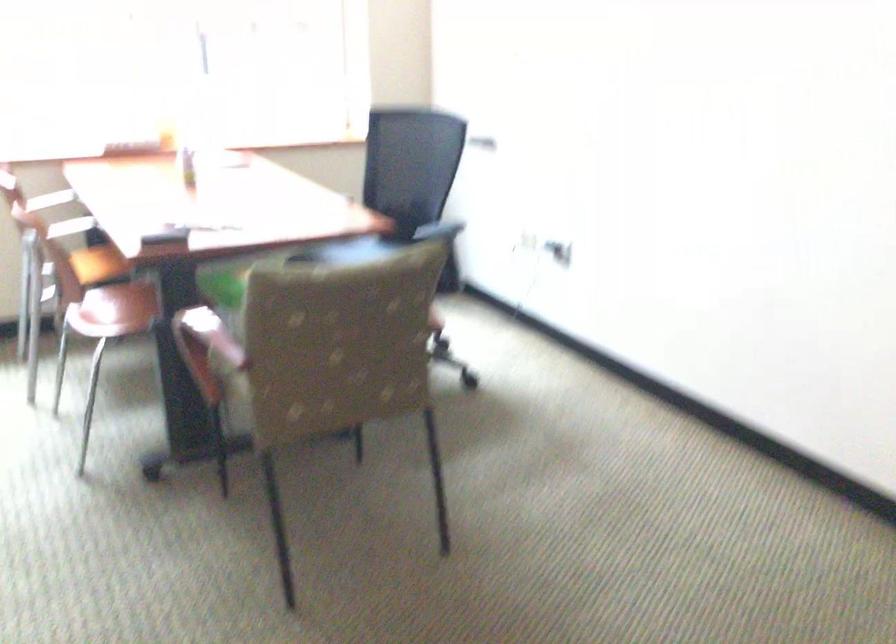
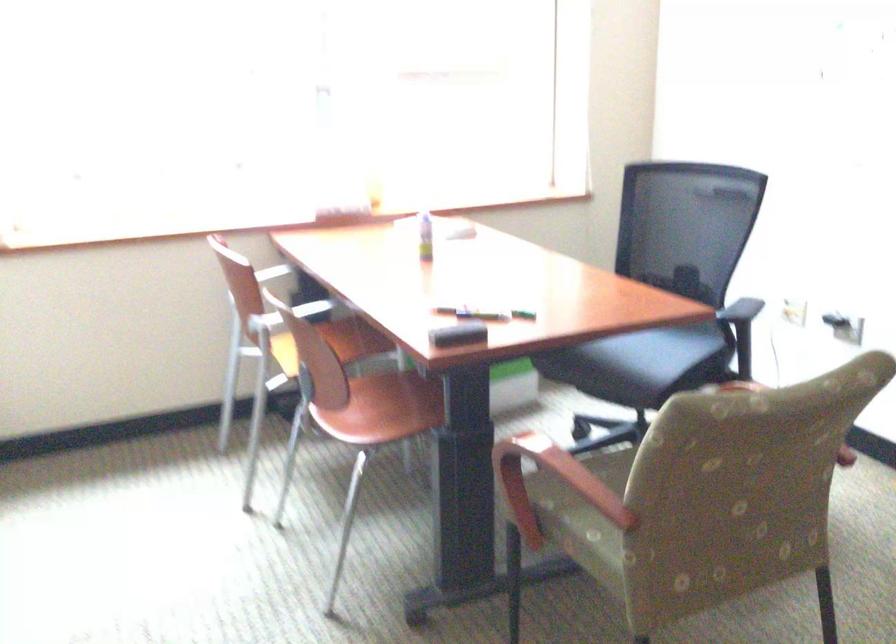
Question: The camera is either moving clockwise (left) or counter-clockwise (right) around the object. The first image is from the beginning of the video and the second image is from the end. Is the camera moving left or right when shooting the video?

Choices:
 (A) Left
 (B) Right

Answer: (B)